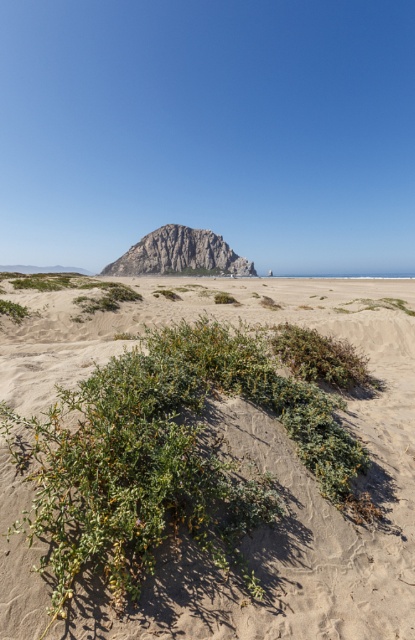
Question: Which point is farther to the camera?

Choices:
 (A) (405, 445)
 (B) (173, 246)

Answer: (B)

Question: Is green shrubbery at center positioned at the back of rugged gray rock at center?

Choices:
 (A) no
 (B) yes

Answer: (A)

Question: From the image, what is the correct spatial relationship of green shrubbery at center in relation to rugged gray rock at center?

Choices:
 (A) right
 (B) left

Answer: (A)

Question: Which point is closer to the camera?

Choices:
 (A) (136, 273)
 (B) (80, 602)

Answer: (B)

Question: Is green shrubbery at center thinner than rugged gray rock at center?

Choices:
 (A) no
 (B) yes

Answer: (B)

Question: Which of the following is the farthest from the observer?

Choices:
 (A) (227, 266)
 (B) (231, 579)

Answer: (A)